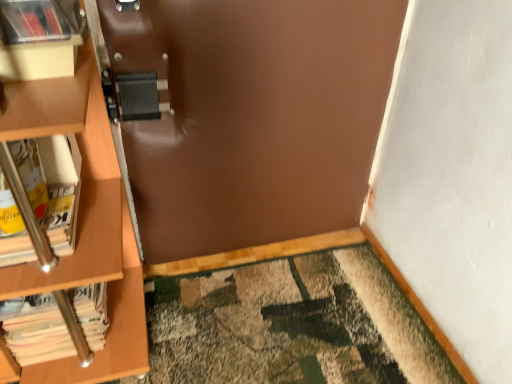
Question: Could you tell me if matte plastic shelf at upper left is facing white paper book at left, the 2th book in the bottom-to-top sequence?

Choices:
 (A) yes
 (B) no

Answer: (B)

Question: Is matte plastic shelf at upper left facing away from white paper book at left, the 2th book in the bottom-to-top sequence?

Choices:
 (A) no
 (B) yes

Answer: (A)

Question: Is matte plastic shelf at upper left beside white paper book at left, the 2th book in the bottom-to-top sequence?

Choices:
 (A) yes
 (B) no

Answer: (B)

Question: From the image's perspective, does matte plastic shelf at upper left appear lower than white paper book at left, the 2th book in the bottom-to-top sequence?

Choices:
 (A) no
 (B) yes

Answer: (A)

Question: Does matte plastic shelf at upper left appear on the right side of white paper book at left, the 2th book in the bottom-to-top sequence?

Choices:
 (A) no
 (B) yes

Answer: (B)

Question: Considering the relative sizes of matte plastic shelf at upper left and white paper book at left, the 2th book in the top-to-bottom sequence, in the image provided, is matte plastic shelf at upper left thinner than white paper book at left, the 2th book in the top-to-bottom sequence,?

Choices:
 (A) yes
 (B) no

Answer: (A)

Question: Does white paper book at left, placed as the 1th book when sorted from bottom to top, lie behind white paper book at left, the 2th book in the bottom-to-top sequence?

Choices:
 (A) yes
 (B) no

Answer: (A)

Question: Is white paper book at left, placed as the 1th book when sorted from bottom to top, shorter than white paper book at left, the 2th book in the top-to-bottom sequence?

Choices:
 (A) yes
 (B) no

Answer: (B)

Question: Does white paper book at left, placed as the 1th book when sorted from bottom to top, have a smaller size compared to white paper book at left, the 2th book in the top-to-bottom sequence?

Choices:
 (A) yes
 (B) no

Answer: (B)

Question: Considering the relative positions of white paper book at left, the 3th book in the top-to-bottom sequence, and white paper book at left, the 2th book in the top-to-bottom sequence, in the image provided, is white paper book at left, the 3th book in the top-to-bottom sequence, to the right of white paper book at left, the 2th book in the top-to-bottom sequence, from the viewer's perspective?

Choices:
 (A) yes
 (B) no

Answer: (A)

Question: From a real-world perspective, is white paper book at left, the 3th book in the top-to-bottom sequence, beneath white paper book at left, the 2th book in the top-to-bottom sequence?

Choices:
 (A) no
 (B) yes

Answer: (B)

Question: From the image's perspective, does white paper book at left, placed as the 1th book when sorted from bottom to top, appear lower than white paper book at left, the 2th book in the bottom-to-top sequence?

Choices:
 (A) yes
 (B) no

Answer: (A)

Question: From the image's perspective, would you say matte plastic shelf at upper left is positioned over matte plastic book at upper left, the 3th book when ordered from bottom to top?

Choices:
 (A) no
 (B) yes

Answer: (A)